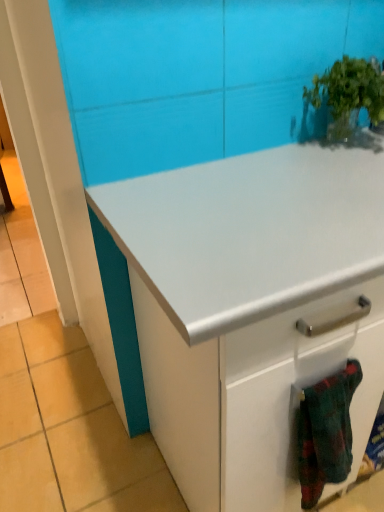
Identify the location of vacant space underneath green leafy plant at upper right (from a real-world perspective). (344, 152).